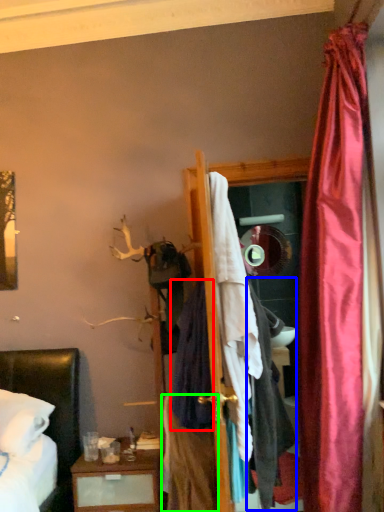
Question: Which is farther away from clothing (highlighted by a red box)? clothing (highlighted by a blue box) or clothing (highlighted by a green box)?

Choices:
 (A) clothing
 (B) clothing

Answer: (A)